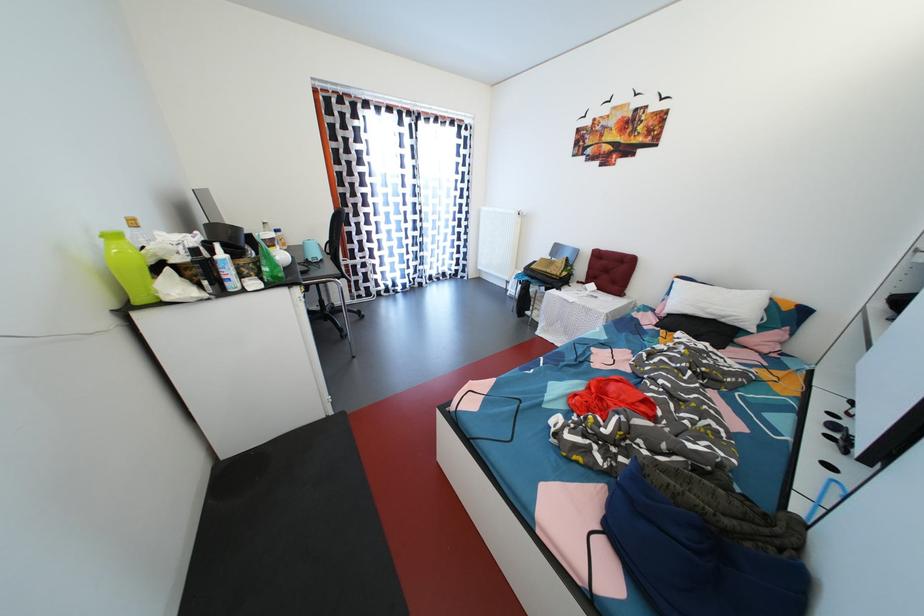
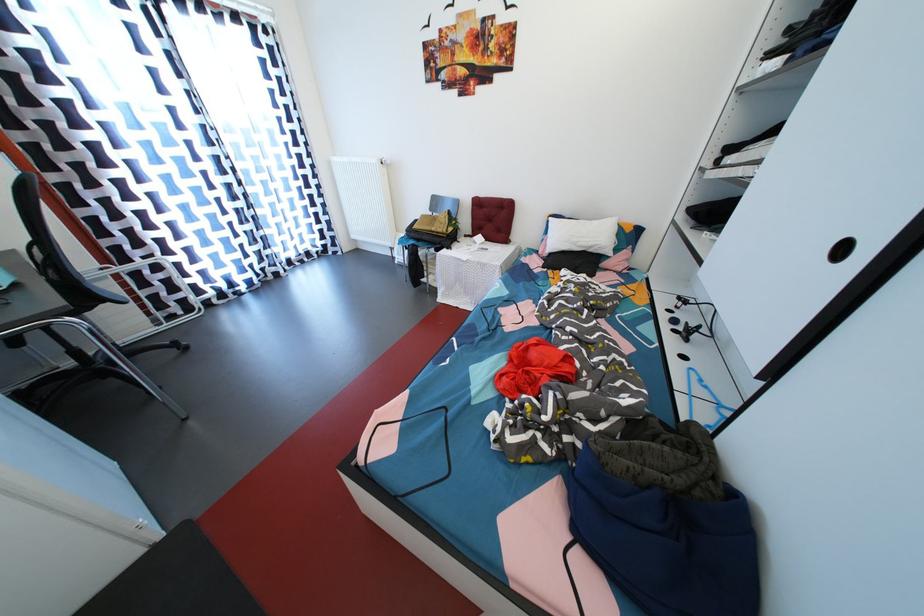
Locate, in the second image, the point that corresponds to (x=835, y=442) in the first image.

(681, 336)